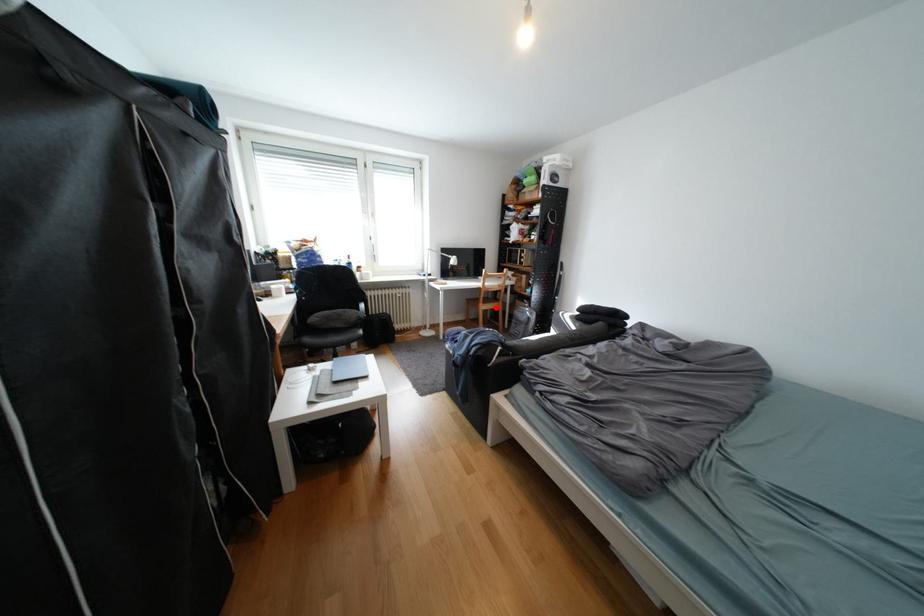
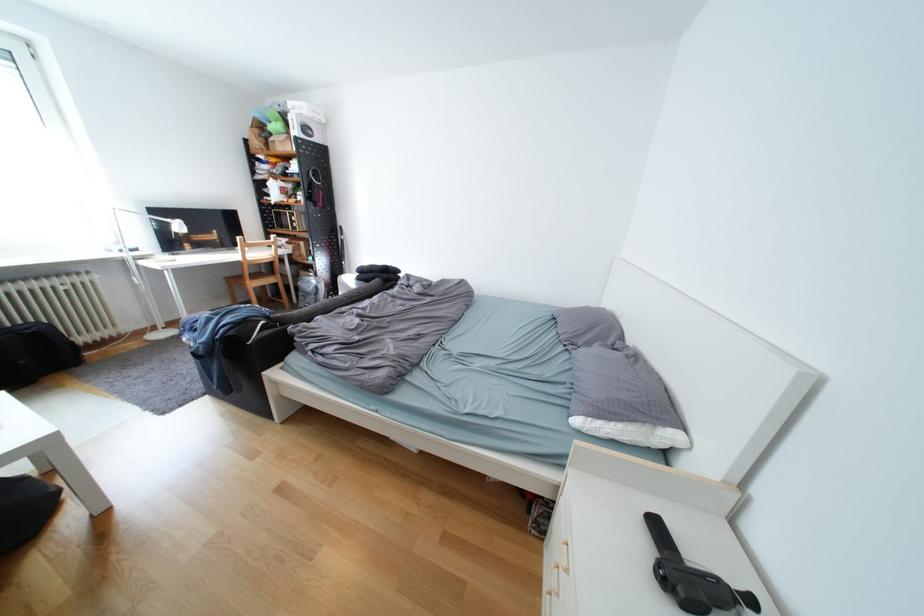
The point at the highlighted location is marked in the first image. Where is the corresponding point in the second image?

(265, 285)